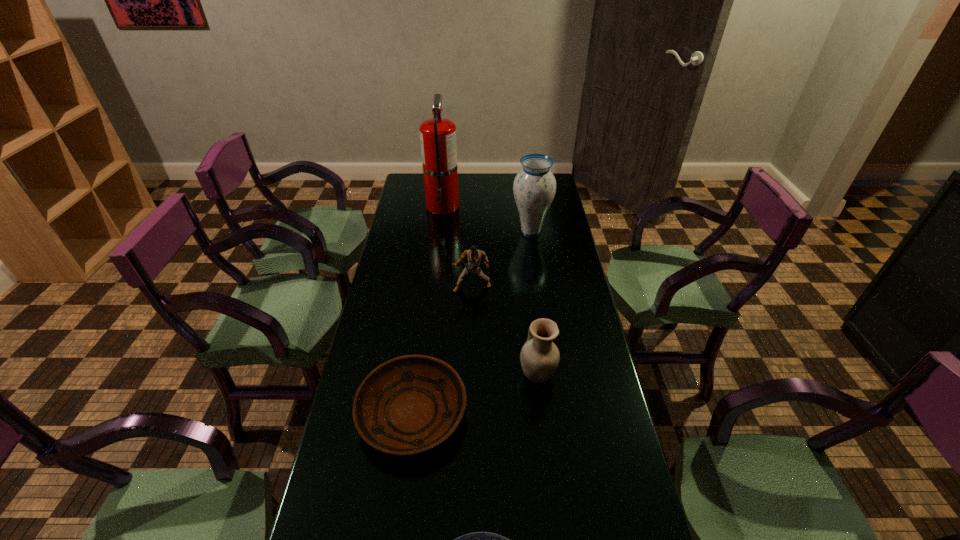
Find the location of a particular element. vacant space located 0.240m on the back of the pottery is located at coordinates (529, 304).

The image size is (960, 540). Find the location of `free space located on the front-facing side of the third farthest object`. free space located on the front-facing side of the third farthest object is located at coordinates click(470, 382).

I want to click on vacant space situated on the right of the taller plate, so click(575, 414).

Find the location of a particular element. The width and height of the screenshot is (960, 540). object that is at the far edge is located at coordinates (438, 141).

Where is `fire extinguisher positioned at the left edge`? fire extinguisher positioned at the left edge is located at coordinates (438, 141).

This screenshot has height=540, width=960. In order to click on plate situated at the left edge in this screenshot , I will do `click(410, 404)`.

Locate an element on the screen. vase that is at the right edge is located at coordinates (534, 187).

In order to click on pottery located at the right edge in this screenshot , I will do point(539,356).

Where is `object that is at the far left corner`? The width and height of the screenshot is (960, 540). object that is at the far left corner is located at coordinates (438, 141).

Image resolution: width=960 pixels, height=540 pixels. In order to click on blank space at the far edge of the desktop in this screenshot , I will do `click(459, 196)`.